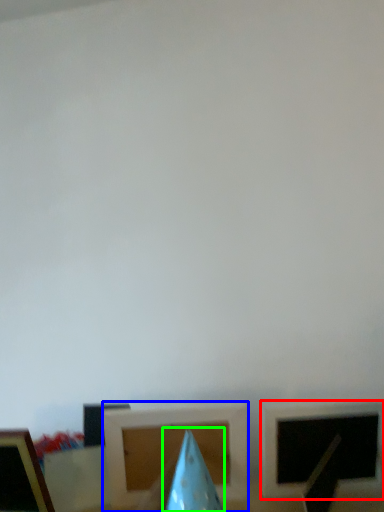
Question: Which is farther away from picture frame (highlighted by a red box)? picture frame (highlighted by a blue box) or exhaust hood (highlighted by a green box)?

Choices:
 (A) picture frame
 (B) exhaust hood

Answer: (B)